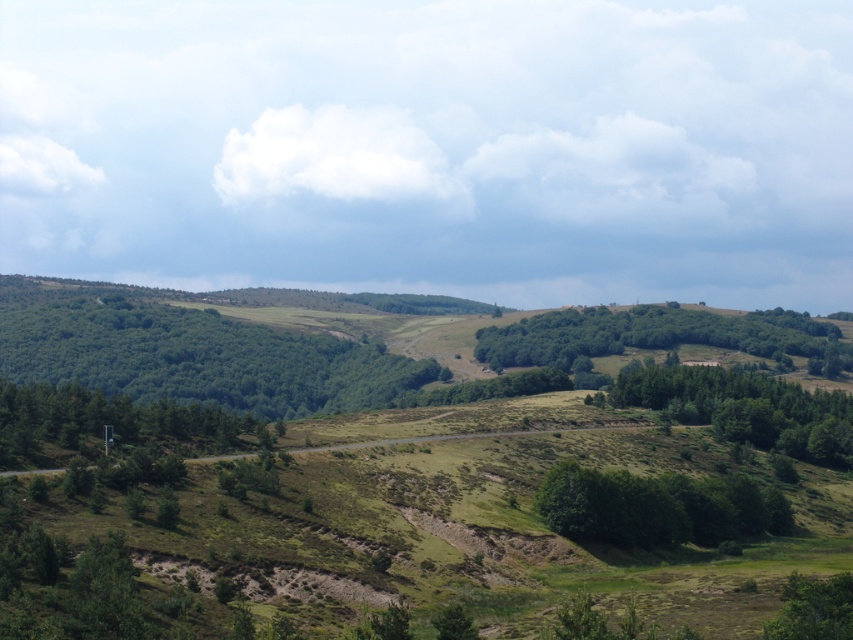
Question: Which object appears closest to the camera in this image?

Choices:
 (A) green leafy tree at lower center
 (B) green matte tree at center-left
 (C) green leafy trees at left

Answer: (A)

Question: Observing the image, what is the correct spatial positioning of green leafy trees at left in reference to green leafy trees at center?

Choices:
 (A) below
 (B) above

Answer: (A)

Question: Does green leafy tree at center appear under green leafy tree at lower right?

Choices:
 (A) yes
 (B) no

Answer: (A)

Question: Does green leafy trees at left appear on the left side of green leafy trees at center-right?

Choices:
 (A) yes
 (B) no

Answer: (A)

Question: Which object appears closest to the camera in this image?

Choices:
 (A) green leafy tree at lower right
 (B) green leafy trees at left
 (C) green matte tree at center-left

Answer: (A)

Question: Among these objects, which one is farthest from the camera?

Choices:
 (A) green leafy tree at lower right
 (B) green leafy trees at left
 (C) green leafy trees at center-right

Answer: (B)